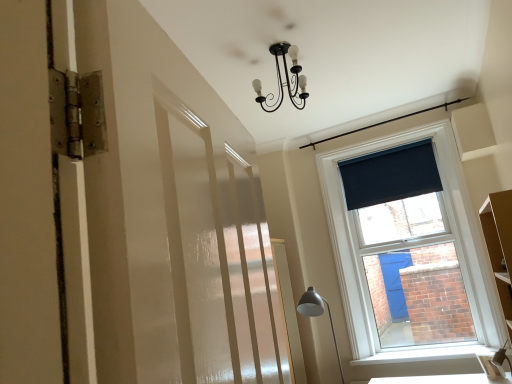
Consider the image. Measure the distance between dark blue fabric at upper right and camera.

dark blue fabric at upper right and camera are 3.71 meters apart from each other.

Image resolution: width=512 pixels, height=384 pixels. Describe the element at coordinates (445, 379) in the screenshot. I see `white glossy table at lower right` at that location.

The width and height of the screenshot is (512, 384). What do you see at coordinates (426, 354) in the screenshot?
I see `white smooth window sill at lower right` at bounding box center [426, 354].

Image resolution: width=512 pixels, height=384 pixels. I want to click on dark blue fabric at upper right, so click(394, 193).

This screenshot has width=512, height=384. Find the location of `table lamp lying on the left of dark blue fabric at upper right`. table lamp lying on the left of dark blue fabric at upper right is located at coordinates (317, 314).

From a real-world perspective, relative to matte gray metal floor lamp at lower right, is dark blue fabric at upper right vertically above or below?

dark blue fabric at upper right is situated higher than matte gray metal floor lamp at lower right in the real world.

Is dark blue fabric at upper right looking in the opposite direction of matte gray metal floor lamp at lower right?

dark blue fabric at upper right does not have its back to matte gray metal floor lamp at lower right.

From the image's perspective, is dark blue fabric at upper right below white smooth window sill at lower right?

No, from the image's perspective, dark blue fabric at upper right is not beneath white smooth window sill at lower right.

Is white smooth window sill at lower right inside dark blue fabric at upper right?

No, white smooth window sill at lower right is not surrounded by dark blue fabric at upper right.

Which of these two, dark blue fabric at upper right or white smooth window sill at lower right, is wider?

Wider between the two is white smooth window sill at lower right.

Between point (345, 194) and point (511, 351), which one is positioned in front?

The point (511, 351) is more forward.

Is matte gray metal floor lamp at lower right outside of white glossy table at lower right?

matte gray metal floor lamp at lower right lies outside white glossy table at lower right's area.

In terms of height, does matte gray metal floor lamp at lower right look taller or shorter compared to white glossy table at lower right?

In the image, matte gray metal floor lamp at lower right appears to be taller than white glossy table at lower right.

Is matte gray metal floor lamp at lower right turned away from white glossy table at lower right?

matte gray metal floor lamp at lower right does not have its back to white glossy table at lower right.

From the image's perspective, between matte gray metal floor lamp at lower right and white glossy table at lower right, who is located below?

white glossy table at lower right appears lower in the image.

Which is further, (452, 345) or (373, 383)?

Positioned behind is point (373, 383).

Are white smooth window sill at lower right and white glossy table at lower right far apart?

Actually, white smooth window sill at lower right and white glossy table at lower right are a little close together.

Is white smooth window sill at lower right taller than white glossy table at lower right?

No, white smooth window sill at lower right is not taller than white glossy table at lower right.

Between white smooth window sill at lower right and white glossy table at lower right, which one appears on the right side from the viewer's perspective?

From the viewer's perspective, white smooth window sill at lower right appears more on the right side.

Is white smooth window sill at lower right far from matte gray metal floor lamp at lower right?

white smooth window sill at lower right is near matte gray metal floor lamp at lower right, not far away.

Which of these two, white smooth window sill at lower right or matte gray metal floor lamp at lower right, is bigger?

matte gray metal floor lamp at lower right is bigger.

From a real-world perspective, is white smooth window sill at lower right under matte gray metal floor lamp at lower right?

Yes, from a real-world perspective, white smooth window sill at lower right is beneath matte gray metal floor lamp at lower right.

Can you tell me how much white smooth window sill at lower right and matte gray metal floor lamp at lower right differ in facing direction?

The angular difference between white smooth window sill at lower right and matte gray metal floor lamp at lower right is 0.354 degrees.

From the image's perspective, is white smooth window sill at lower right on dark blue fabric at upper right?

No.

Relative to dark blue fabric at upper right, is white smooth window sill at lower right in front or behind?

Visually, white smooth window sill at lower right is located in front of dark blue fabric at upper right.

Could you tell me if white smooth window sill at lower right is facing dark blue fabric at upper right?

No.

Which of these two, white smooth window sill at lower right or dark blue fabric at upper right, is bigger?

Bigger between the two is dark blue fabric at upper right.

Is white glossy table at lower right closer to the viewer compared to white smooth window sill at lower right?

Yes, white glossy table at lower right is closer to the viewer.

From a real-world perspective, is white glossy table at lower right beneath white smooth window sill at lower right?

Indeed, from a real-world perspective, white glossy table at lower right is positioned beneath white smooth window sill at lower right.

Do you think white glossy table at lower right is within white smooth window sill at lower right, or outside of it?

The correct answer is: outside.

From the image's perspective, between white glossy table at lower right and white smooth window sill at lower right, which one is located above?

white smooth window sill at lower right, from the image's perspective.

Identify the location of window screen above the matte gray metal floor lamp at lower right (from a real-world perspective). This screenshot has width=512, height=384. (394, 193).

This screenshot has width=512, height=384. I want to click on window sill below the dark blue fabric at upper right (from a real-world perspective), so click(426, 354).

Considering their positions, is white glossy table at lower right positioned closer to dark blue fabric at upper right than matte gray metal floor lamp at lower right?

The object closer to dark blue fabric at upper right is matte gray metal floor lamp at lower right.

When comparing their distances from dark blue fabric at upper right, does matte gray metal floor lamp at lower right or white glossy table at lower right seem closer?

matte gray metal floor lamp at lower right lies closer to dark blue fabric at upper right than the other object.

Looking at the image, which one is located further to matte gray metal floor lamp at lower right, dark blue fabric at upper right or white smooth window sill at lower right?

dark blue fabric at upper right is positioned further to the anchor matte gray metal floor lamp at lower right.

Estimate the real-world distances between objects in this image. Which object is closer to white smooth window sill at lower right, dark blue fabric at upper right or matte gray metal floor lamp at lower right?

matte gray metal floor lamp at lower right is positioned closer to the anchor white smooth window sill at lower right.

Estimate the real-world distances between objects in this image. Which object is further from matte gray metal floor lamp at lower right, white smooth window sill at lower right or white glossy table at lower right?

Based on the image, white glossy table at lower right appears to be further to matte gray metal floor lamp at lower right.

Looking at this image, which object lies further to the anchor point white smooth window sill at lower right, white glossy table at lower right or dark blue fabric at upper right?

dark blue fabric at upper right lies further to white smooth window sill at lower right than the other object.

Looking at the image, which one is located further to matte gray metal floor lamp at lower right, white glossy table at lower right or white smooth window sill at lower right?

The object further to matte gray metal floor lamp at lower right is white glossy table at lower right.

Based on their spatial positions, is white glossy table at lower right or dark blue fabric at upper right further from matte gray metal floor lamp at lower right?

The object further to matte gray metal floor lamp at lower right is dark blue fabric at upper right.

This screenshot has height=384, width=512. Identify the location of table lamp between dark blue fabric at upper right and white smooth window sill at lower right from top to bottom. (317, 314).

At what (x,y) coordinates should I click in order to perform the action: click on table lamp between dark blue fabric at upper right and white glossy table at lower right in the up-down direction. Please return your answer as a coordinate pair (x, y). The height and width of the screenshot is (384, 512). Looking at the image, I should click on (317, 314).

Locate an element on the screen. This screenshot has width=512, height=384. table located between matte gray metal floor lamp at lower right and white smooth window sill at lower right in the left-right direction is located at coordinates (445, 379).

At what (x,y) coordinates should I click in order to perform the action: click on window sill that lies between dark blue fabric at upper right and white glossy table at lower right from top to bottom. Please return your answer as a coordinate pair (x, y). This screenshot has height=384, width=512. Looking at the image, I should click on (426, 354).